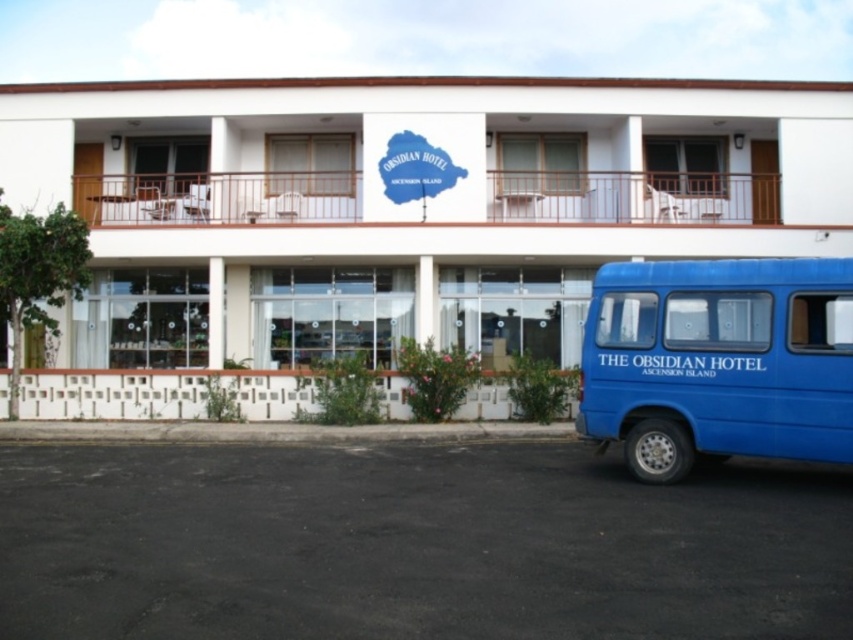
You are a delivery driver who needs to park your blue matte van at lower right near The Obsidian Hotel. Based on the scene, can you park the van directly in front of the white matte building at center?

The white matte building at center is located above the blue matte van at lower right, which means the van is already positioned below the building. Since parking directly in front would require space in front of the building, but the van is positioned lower down, it might not be possible unless there is an open area in front. However, according to the description, the van is at lower right, so parking directly in front of the building may not be feasible as the van is positioned below it, not in front.